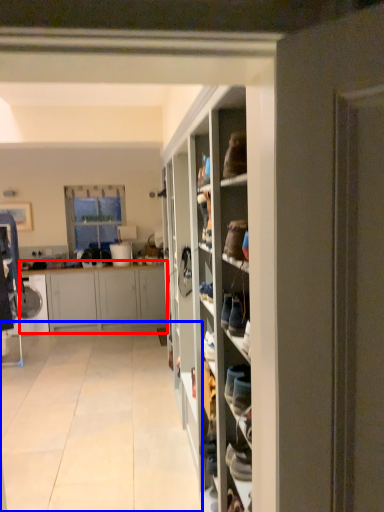
Question: Which object is further to the camera taking this photo, cabinetry (highlighted by a red box) or corridor (highlighted by a blue box)?

Choices:
 (A) cabinetry
 (B) corridor

Answer: (A)